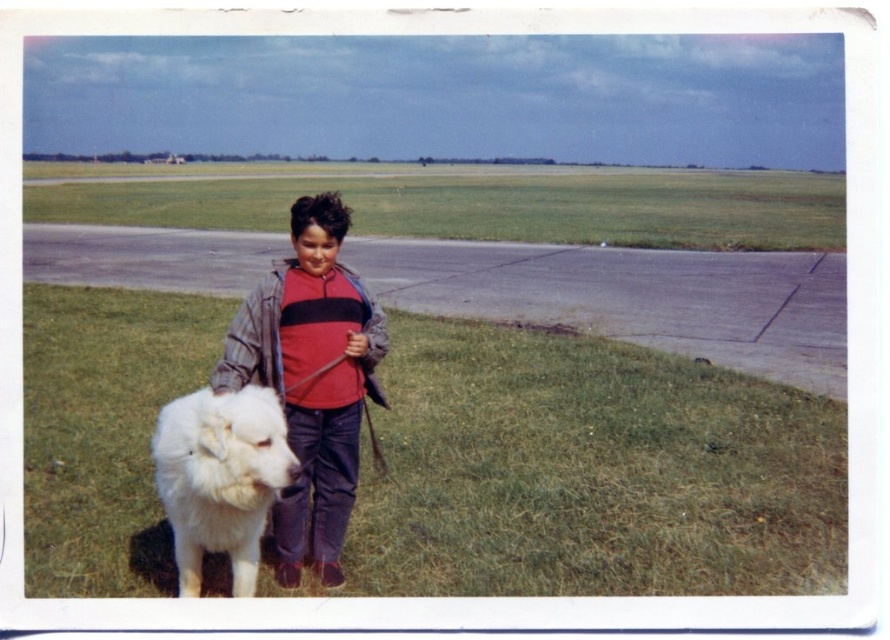
Is matte red shirt at center wider than white fluffy dog at lower left?

Incorrect, matte red shirt at center's width does not surpass white fluffy dog at lower left's.

Is point (281, 352) positioned before point (203, 406)?

No, (281, 352) is behind (203, 406).

Is point (358, 307) positioned behind point (239, 394)?

Yes, it is.

Locate an element on the screen. The height and width of the screenshot is (640, 890). matte red shirt at center is located at coordinates (312, 380).

Does green grass at lower left appear on the left side of white fluffy dog at lower left?

Yes, green grass at lower left is to the left of white fluffy dog at lower left.

Who is lower down, green grass at lower left or white fluffy dog at lower left?

white fluffy dog at lower left is lower down.

Locate an element on the screen. The width and height of the screenshot is (890, 640). green grass at lower left is located at coordinates (591, 472).

Between green grass at lower left and green grass at upper center, which one has less height?

green grass at lower left is shorter.

Is point (59, 554) positioned before point (193, 204)?

Yes, point (59, 554) is closer to viewer.

Locate an element on the screen. The height and width of the screenshot is (640, 890). green grass at lower left is located at coordinates (591, 472).